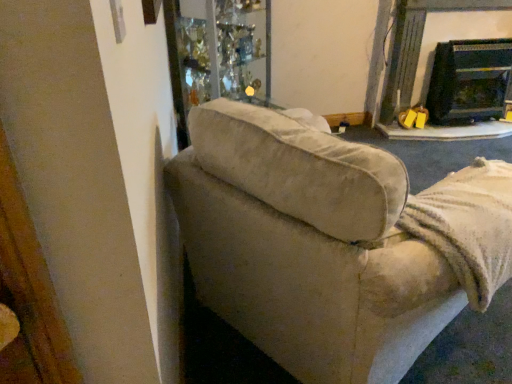
Question: Considering the positions of black glass fireplace at upper right, placed as the second fireplace when sorted from left to right, and beige fabric couch at left in the image, is black glass fireplace at upper right, placed as the second fireplace when sorted from left to right, taller or shorter than beige fabric couch at left?

Choices:
 (A) tall
 (B) short

Answer: (B)

Question: Is black glass fireplace at upper right, placed as the second fireplace when sorted from left to right, situated inside beige fabric couch at left or outside?

Choices:
 (A) outside
 (B) inside

Answer: (A)

Question: Estimate the real-world distances between objects in this image. Which object is farther from the black glossy fireplace at upper right, which ranks as the second fireplace in right-to-left order?

Choices:
 (A) transparent glass cabinet at upper center
 (B) black glass fireplace at upper right, placed as the first fireplace when sorted from right to left
 (C) beige fabric couch at left

Answer: (C)

Question: Estimate the real-world distances between objects in this image. Which object is closer to the black glossy fireplace at upper right, which ranks as the second fireplace in right-to-left order?

Choices:
 (A) transparent glass cabinet at upper center
 (B) beige fabric couch at left
 (C) black glass fireplace at upper right, placed as the second fireplace when sorted from left to right

Answer: (C)